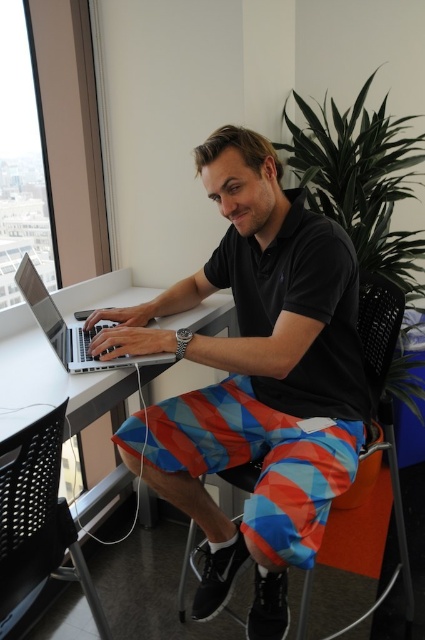
Question: Which point appears closest to the camera in this image?

Choices:
 (A) (27, 209)
 (B) (183, 317)
 (C) (399, 492)

Answer: (C)

Question: Which of the following is the closest to the observer?

Choices:
 (A) orange fabric chair at center
 (B) matte black polo shirt at center
 (C) transparent glass window at upper left
 (D) black mesh chair at lower left

Answer: (D)

Question: Is matte black polo shirt at center to the right of orange fabric chair at center from the viewer's perspective?

Choices:
 (A) yes
 (B) no

Answer: (B)

Question: Is white plastic table at left wider than orange fabric chair at center?

Choices:
 (A) no
 (B) yes

Answer: (B)

Question: Does black mesh chair at lower left appear under silver metallic laptop at center?

Choices:
 (A) no
 (B) yes

Answer: (B)

Question: Which object is closer to the camera taking this photo?

Choices:
 (A) matte black polo shirt at center
 (B) black mesh chair at lower left
 (C) silver metallic laptop at center
 (D) transparent glass window at upper left

Answer: (B)